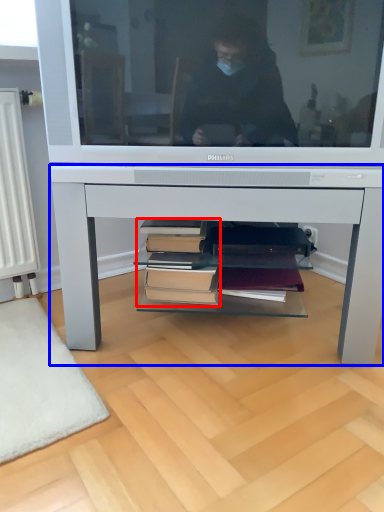
Question: Which of the following is the closest to the observer, book (highlighted by a red box) or desk (highlighted by a blue box)?

Choices:
 (A) book
 (B) desk

Answer: (B)